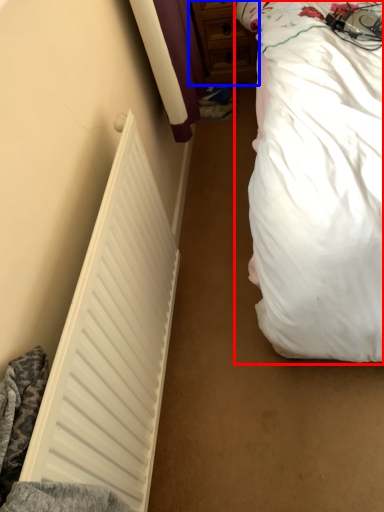
Question: Which object is closer to the camera taking this photo, bed (highlighted by a red box) or dresser (highlighted by a blue box)?

Choices:
 (A) bed
 (B) dresser

Answer: (A)